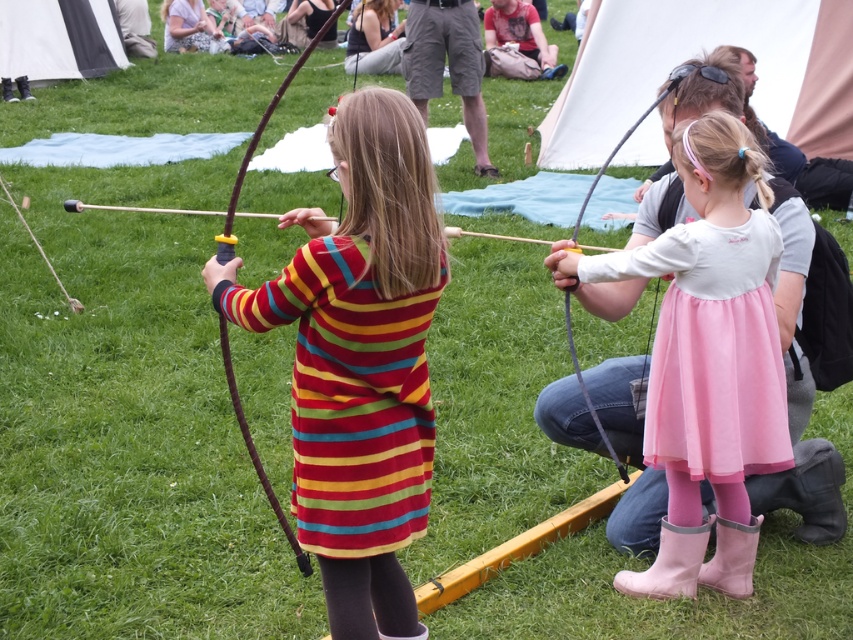
Question: Which point is farther from the camera taking this photo?

Choices:
 (A) (370, 564)
 (B) (701, 380)
 (C) (775, 412)

Answer: (C)

Question: Does striped fabric dress at center have a greater width compared to pink tulle dress at center?

Choices:
 (A) no
 (B) yes

Answer: (B)

Question: Can you confirm if striped fabric dress at center is positioned below pink satin dress at center?

Choices:
 (A) no
 (B) yes

Answer: (A)

Question: Which of the following is the closest to the observer?

Choices:
 (A) pink tulle dress at center
 (B) striped fabric dress at center

Answer: (B)

Question: Estimate the real-world distances between objects in this image. Which object is farther from the striped fabric dress at center?

Choices:
 (A) pink tulle dress at center
 (B) pink satin dress at center

Answer: (A)

Question: Does pink satin dress at center come behind pink tulle dress at center?

Choices:
 (A) no
 (B) yes

Answer: (A)